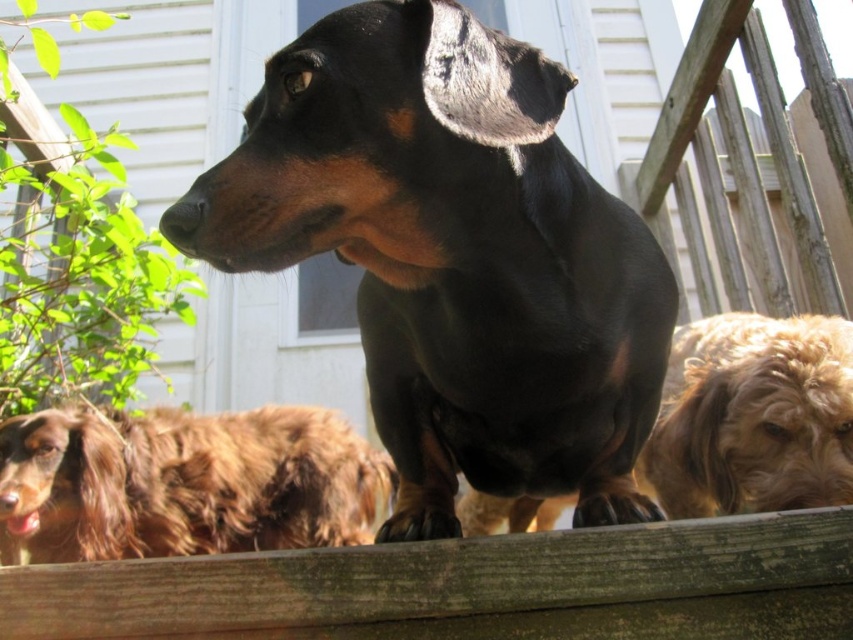
Is brown shaggy dog at lower left to the left of golden brown fur at right from the viewer's perspective?

Correct, you'll find brown shaggy dog at lower left to the left of golden brown fur at right.

Who is more distant from viewer, (276,518) or (782,497)?

Point (276,518)

Who is more forward, (317,522) or (720,448)?

Positioned in front is point (720,448).

Where is `brown shaggy dog at lower left`? brown shaggy dog at lower left is located at coordinates (184, 481).

Is black shiny dog at center to the right of brown shaggy dog at lower left from the viewer's perspective?

Yes, black shiny dog at center is to the right of brown shaggy dog at lower left.

Between black shiny dog at center and brown shaggy dog at lower left, which one appears on the right side from the viewer's perspective?

black shiny dog at center

What do you see at coordinates (454, 257) in the screenshot? This screenshot has height=640, width=853. I see `black shiny dog at center` at bounding box center [454, 257].

In order to click on black shiny dog at center in this screenshot , I will do `click(454, 257)`.

Is black shiny dog at center below golden brown fur at right?

No.

Based on the photo, is black shiny dog at center bigger than golden brown fur at right?

Yes.

What do you see at coordinates (454, 257) in the screenshot? The height and width of the screenshot is (640, 853). I see `black shiny dog at center` at bounding box center [454, 257].

Find the location of `black shiny dog at center`. black shiny dog at center is located at coordinates (454, 257).